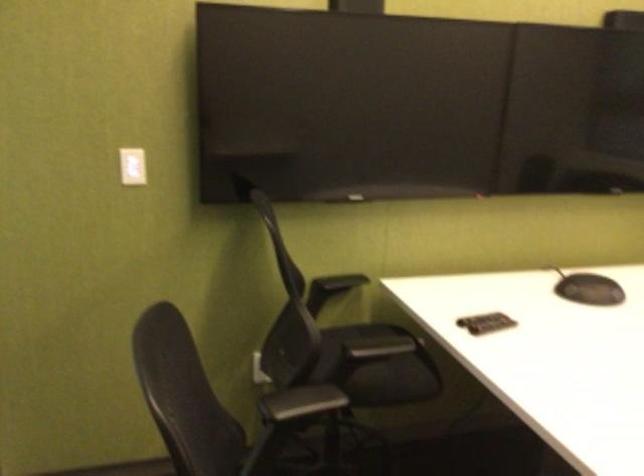
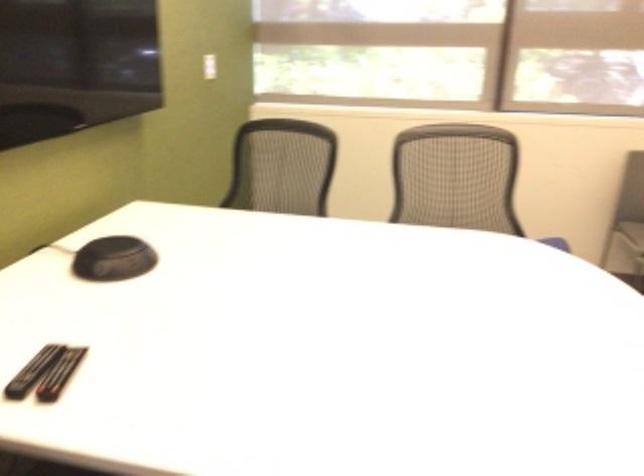
In the second image, find the point that corresponds to point 478,318 in the first image.

(32, 371)